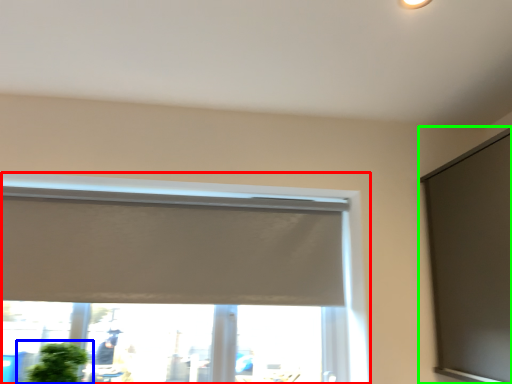
Question: Which object is the closest to the window (highlighted by a red box)? Choose among these: houseplant (highlighted by a blue box) or window screen (highlighted by a green box).

Choices:
 (A) houseplant
 (B) window screen

Answer: (B)